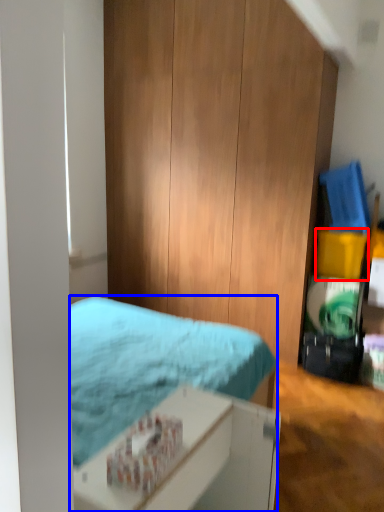
Question: Which object appears closest to the camera in this image, box (highlighted by a red box) or bed (highlighted by a blue box)?

Choices:
 (A) box
 (B) bed

Answer: (B)